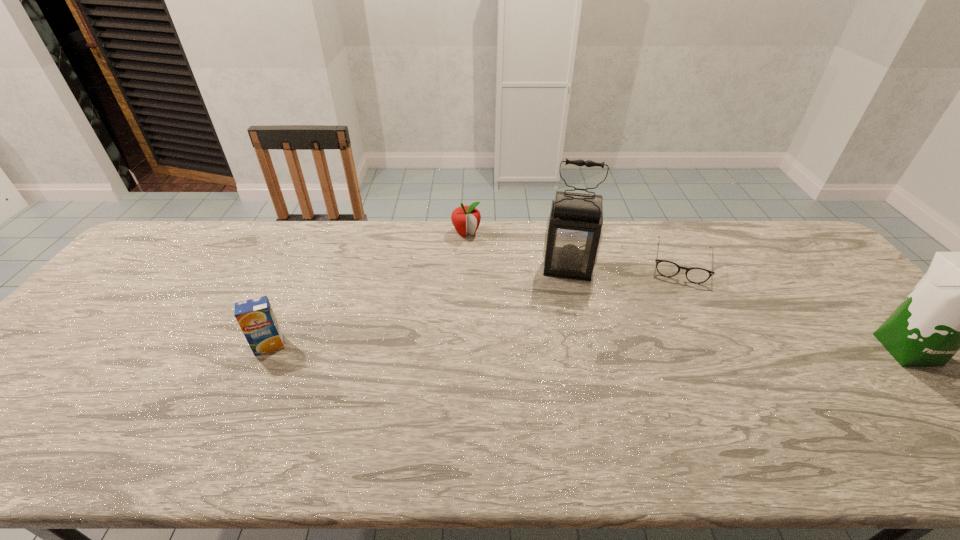
Identify the location of vacant space located 0.110m on the back of the leftmost object. (288, 306).

Find the location of a particular element. vacant space located on the front-facing side of the second tallest object is located at coordinates (950, 396).

The height and width of the screenshot is (540, 960). I want to click on free region located 0.250m on the side where a bite is taken out of the second shortest object, so click(x=495, y=289).

The width and height of the screenshot is (960, 540). I want to click on free space located on the side where a bite is taken out of the second shortest object, so click(x=500, y=299).

At what (x,y) coordinates should I click in order to perform the action: click on vacant area located 0.090m on the side where a bite is taken out of the second shortest object. Please return your answer as a coordinate pair (x, y). This screenshot has width=960, height=540. Looking at the image, I should click on (479, 257).

The height and width of the screenshot is (540, 960). Find the location of `vacant space located on the front-facing side of the tallest object`. vacant space located on the front-facing side of the tallest object is located at coordinates (558, 392).

Locate an element on the screen. This screenshot has width=960, height=540. blank space located on the front-facing side of the tallest object is located at coordinates (564, 321).

You are a GUI agent. You are given a task and a screenshot of the screen. Output one action in this format:
    pyautogui.click(x=<x>, y=<y>)
    Task: Click on the free space located on the front-facing side of the tallest object
    The image size is (960, 540).
    Given the screenshot: What is the action you would take?
    pyautogui.click(x=564, y=313)

In order to click on free space located through the lenses of the spectacles in this screenshot , I will do `click(674, 354)`.

Identify the location of vacant region located 0.140m through the lenses of the spectacles. The image size is (960, 540). (677, 316).